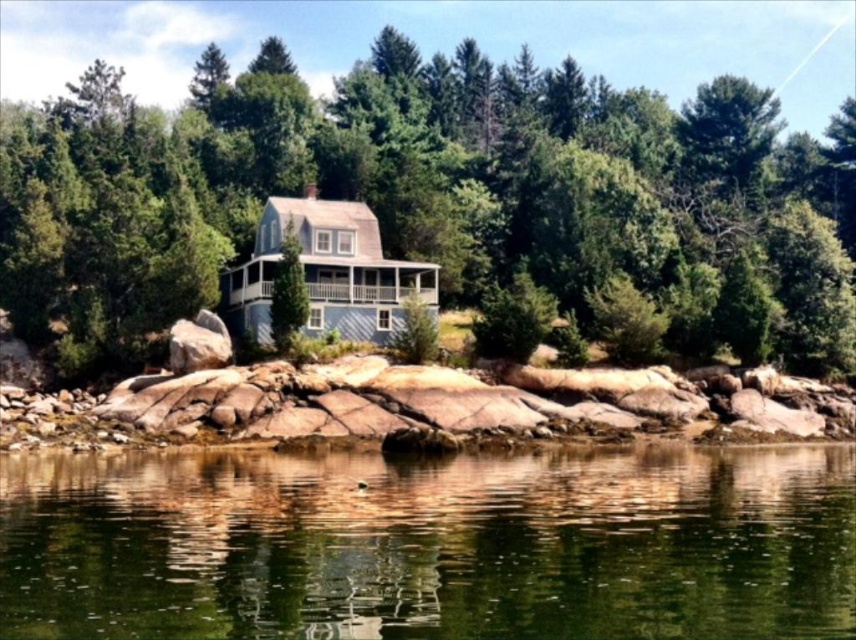
You are standing on the wraparound porch of the soft blue gray house and want to take a photo of the green textured tree at center and the green reflective water at center. Which object will appear closer to the camera in the photo?

The green textured tree at center will appear closer to the camera in the photo because the green reflective water at center is positioned behind it.

You are standing on the wraparound porch of the soft blue gray house and want to observe the green textured tree at center and the green reflective water at center. Which object is closer to you from your vantage point on the porch?

The green textured tree at center is positioned over the green reflective water at center, meaning the tree is closer to you than the water from your vantage point on the porch.